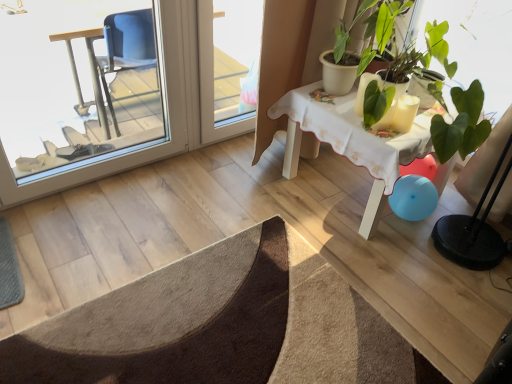
This screenshot has width=512, height=384. I want to click on free area in between transparent plastic screen door at upper center, marked as the 1th screen door in a right-to-left arrangement, and brown textured doormat at lower left, so click(245, 208).